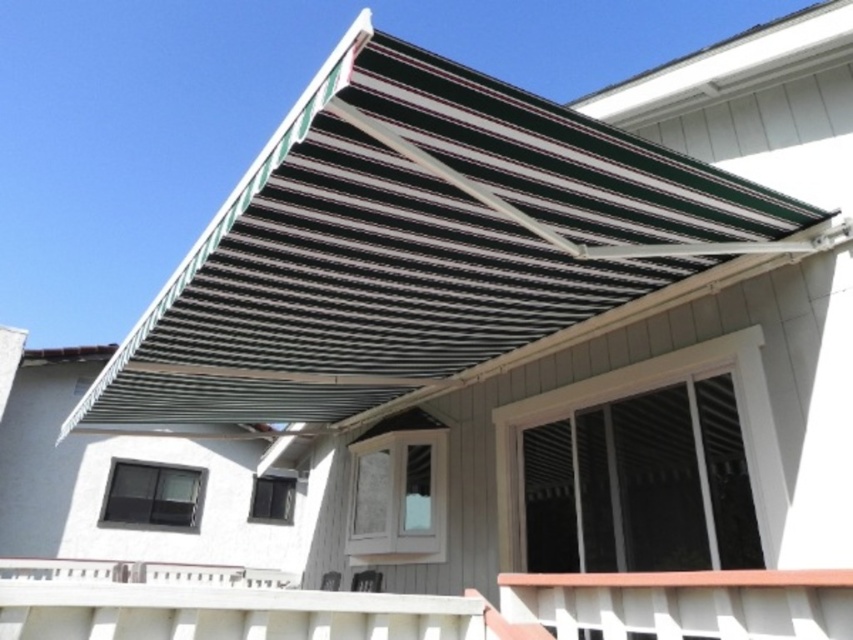
Is black striped awning at upper center closer to the viewer compared to white plastic balustrade at lower center?

Yes, it is.

Does black striped awning at upper center have a greater height compared to white plastic balustrade at lower center?

Yes, black striped awning at upper center is taller than white plastic balustrade at lower center.

Who is more distant from viewer, (x=560, y=200) or (x=7, y=566)?

Answer: The point (x=7, y=566) is more distant.

I want to click on black striped awning at upper center, so click(428, 248).

Is point (834, 593) behind point (231, 586)?

No, it is not.

Between white plastic balustrade at lower right and white plastic balustrade at lower center, which one has less height?

With less height is white plastic balustrade at lower right.

Who is more distant from viewer, (x=621, y=582) or (x=234, y=570)?

The point (x=234, y=570) is more distant.

Where is `white plastic balustrade at lower right`? Image resolution: width=853 pixels, height=640 pixels. white plastic balustrade at lower right is located at coordinates (683, 602).

Is point (44, 573) farther from viewer compared to point (837, 621)?

Yes.

Is white wooden porch at lower center bigger than white plastic balustrade at lower right?

Indeed, white wooden porch at lower center has a larger size compared to white plastic balustrade at lower right.

Does point (163, 596) come in front of point (785, 605)?

No, (163, 596) is behind (785, 605).

The image size is (853, 640). Identify the location of white wooden porch at lower center. (x=415, y=605).